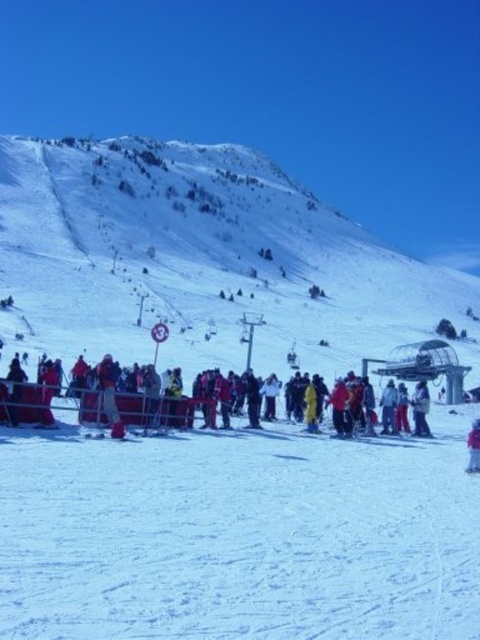
Is red fabric crowd at center wider than white matte jacket at center?

Indeed, red fabric crowd at center has a greater width compared to white matte jacket at center.

Is point (33, 401) positioned behind point (420, 387)?

That is False.

This screenshot has width=480, height=640. What do you see at coordinates (159, 396) in the screenshot?
I see `red fabric crowd at center` at bounding box center [159, 396].

This screenshot has width=480, height=640. What are the coordinates of `red fabric crowd at center` in the screenshot? It's located at (159, 396).

Who is more distant from viewer, (99, 401) or (468, 438)?

The point (99, 401) is more distant.

This screenshot has height=640, width=480. Find the location of `red fabric crowd at center`. red fabric crowd at center is located at coordinates (159, 396).

Image resolution: width=480 pixels, height=640 pixels. In order to click on red fabric crowd at center in this screenshot , I will do `click(159, 396)`.

Can you confirm if white matte jacket at center is positioned to the left of pink fabric at center?

Indeed, white matte jacket at center is positioned on the left side of pink fabric at center.

Is white matte jacket at center smaller than pink fabric at center?

Yes.

Which is in front, point (423, 387) or point (474, 422)?

Point (474, 422) is more forward.

I want to click on white matte jacket at center, so click(420, 410).